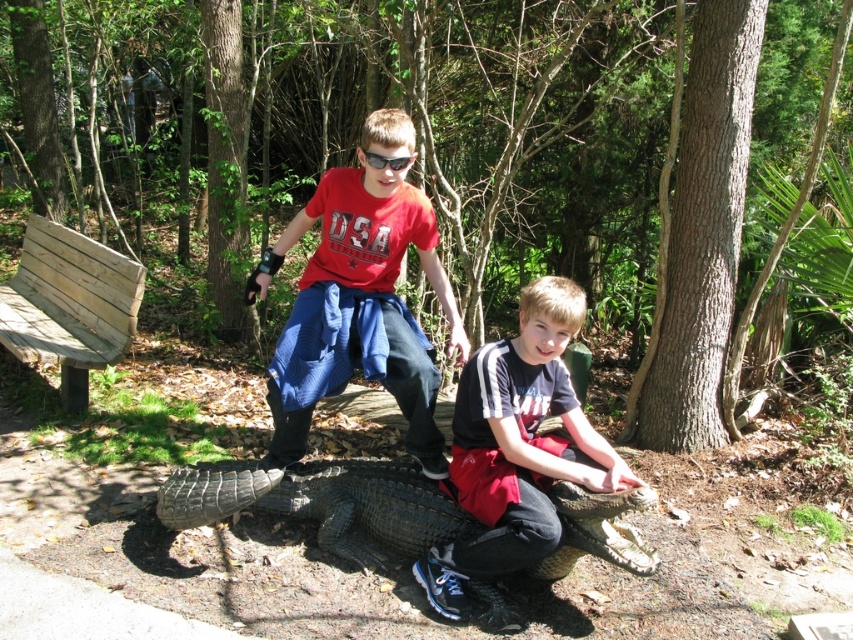
Question: Is matte red shirt at center below dark gray scaly crocodile at center?

Choices:
 (A) yes
 (B) no

Answer: (B)

Question: Can you confirm if matte red shirt at center is thinner than dark blue denim jeans at lower center?

Choices:
 (A) no
 (B) yes

Answer: (A)

Question: Among these points, which one is nearest to the camera?

Choices:
 (A) (579, 452)
 (B) (374, 157)
 (C) (387, 177)
 (D) (252, 493)

Answer: (D)

Question: Which is farther from the dark blue denim jeans at lower center?

Choices:
 (A) dark gray scaly crocodile at center
 (B) sunglasses at center
 (C) matte red shirt at center

Answer: (B)

Question: Which of the following is the farthest from the observer?

Choices:
 (A) 601,451
 (B) 91,337
 (C) 366,164

Answer: (B)

Question: Can you confirm if matte red shirt at center is positioned to the left of dark blue denim jeans at lower center?

Choices:
 (A) yes
 (B) no

Answer: (A)